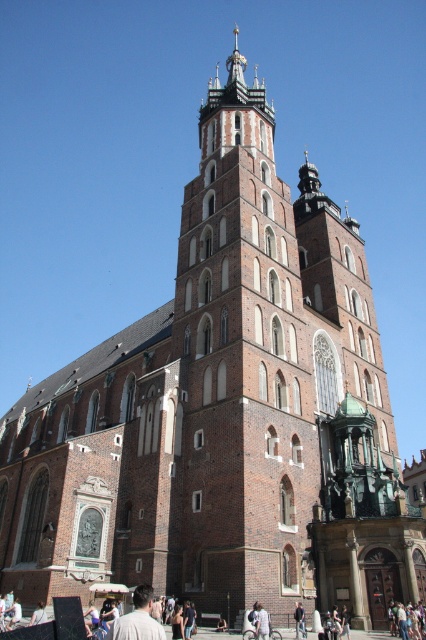
Question: Which object is farther from the camera taking this photo?

Choices:
 (A) light brown leather jacket at center
 (B) light brown leather jacket at lower left
 (C) light beige shirt at lower center

Answer: (A)

Question: Is light beige shirt at lower center wider than light brown leather jacket at center?

Choices:
 (A) yes
 (B) no

Answer: (A)

Question: Is light brown leather jacket at center to the right of light brown leather jacket at lower left from the viewer's perspective?

Choices:
 (A) yes
 (B) no

Answer: (A)

Question: From the image, what is the correct spatial relationship of light brown leather jacket at center in relation to light brown leather jacket at lower left?

Choices:
 (A) above
 (B) below

Answer: (A)

Question: Which object is positioned farthest from the light beige shirt at lower center?

Choices:
 (A) light brown leather jacket at center
 (B) light brown leather jacket at lower left

Answer: (A)

Question: Among these points, which one is farthest from the camera?

Choices:
 (A) (39, 612)
 (B) (134, 614)

Answer: (A)